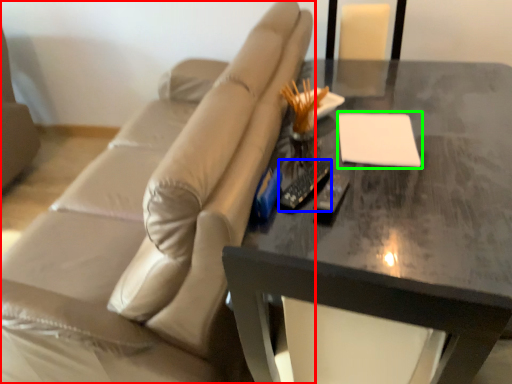
Question: Estimate the real-world distances between objects in this image. Which object is closer to studio couch (highlighted by a red box), remote (highlighted by a blue box) or notepad (highlighted by a green box)?

Choices:
 (A) remote
 (B) notepad

Answer: (B)